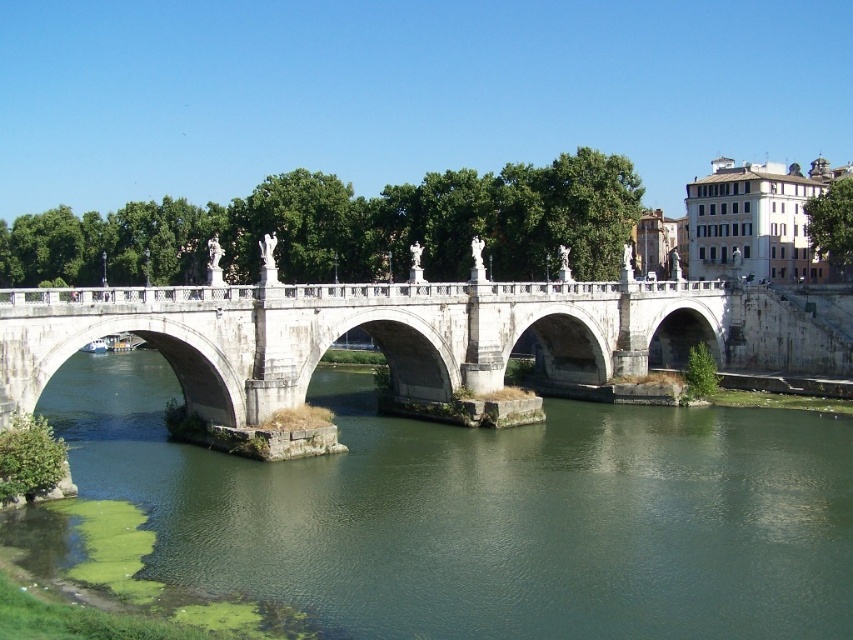
Question: Is green algae water at lower left to the right of white stone bridge at center from the viewer's perspective?

Choices:
 (A) no
 (B) yes

Answer: (A)

Question: Where is green algae water at lower left located in relation to white stone bridge at center in the image?

Choices:
 (A) above
 (B) below

Answer: (B)

Question: Which of the following is the farthest from the observer?

Choices:
 (A) (469, 310)
 (B) (340, 636)

Answer: (A)

Question: Which of the following is the farthest from the observer?

Choices:
 (A) (477, 381)
 (B) (78, 388)

Answer: (B)

Question: Considering the relative positions of green algae water at lower left and white stone bridge at center in the image provided, where is green algae water at lower left located with respect to white stone bridge at center?

Choices:
 (A) left
 (B) right

Answer: (A)